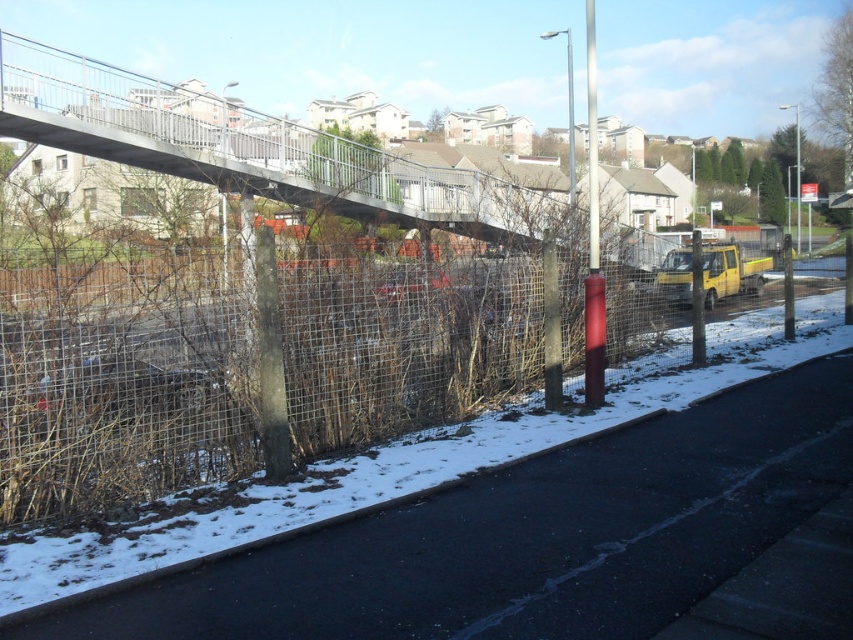
Is wire mesh fence at lower left smaller than smooth red pole at center?

Yes.

Between wire mesh fence at lower left and smooth red pole at center, which one is positioned lower?

wire mesh fence at lower left is lower down.

Identify the location of wire mesh fence at lower left. This screenshot has width=853, height=640. (117, 412).

Identify the location of wire mesh fence at lower left. point(117,412).

Which is more to the right, smooth gray pole at center or smooth red pole at center?

smooth red pole at center is more to the right.

Does smooth gray pole at center have a lesser width compared to smooth red pole at center?

Correct, smooth gray pole at center's width is less than smooth red pole at center's.

This screenshot has height=640, width=853. What do you see at coordinates (270, 362) in the screenshot? I see `smooth gray pole at center` at bounding box center [270, 362].

Locate an element on the screen. Image resolution: width=853 pixels, height=640 pixels. smooth gray pole at center is located at coordinates (270, 362).

Which is more to the left, wire mesh fence at lower left or smooth gray pole at center?

From the viewer's perspective, wire mesh fence at lower left appears more on the left side.

Who is higher up, wire mesh fence at lower left or smooth gray pole at center?

Positioned higher is smooth gray pole at center.

Between point (387, 403) and point (262, 355), which one is positioned behind?

Point (387, 403)

Identify the location of wire mesh fence at lower left. This screenshot has height=640, width=853. (117, 412).